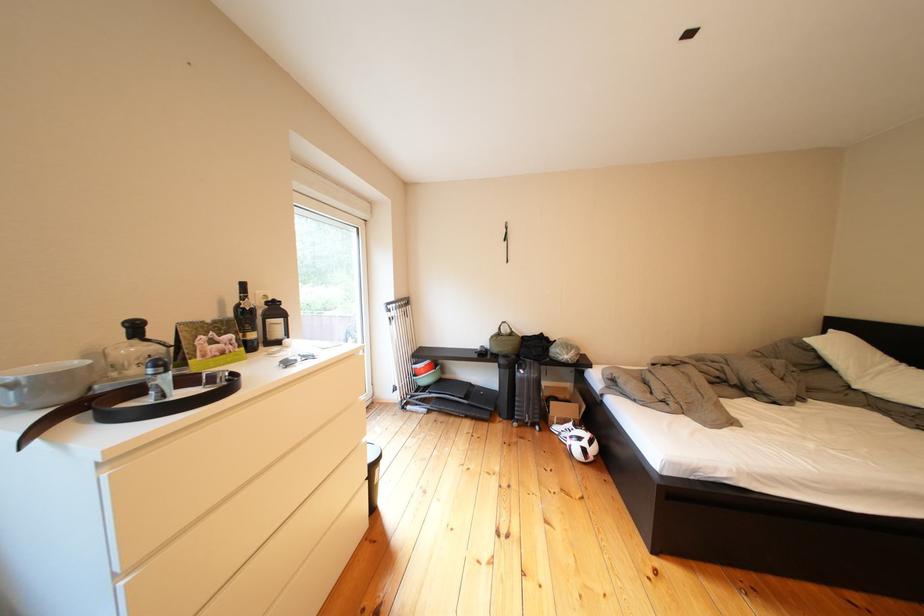
Find where to lift the black trash can. Please return your answer as a coordinate pair (x, y).

(372, 475)